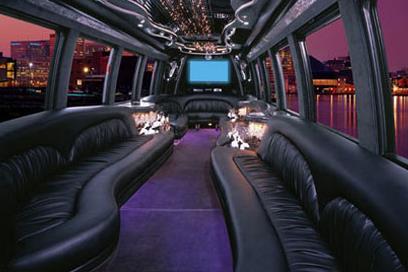
The height and width of the screenshot is (272, 408). What are the coordinates of `seat` in the screenshot? It's located at (89, 189).